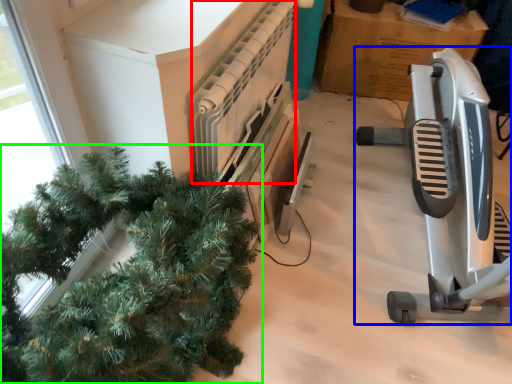
Question: Based on their relative distances, which object is nearer to radiator (highlighted by a red box)? Choose from job (highlighted by a blue box) and houseplant (highlighted by a green box).

Choices:
 (A) job
 (B) houseplant

Answer: (B)